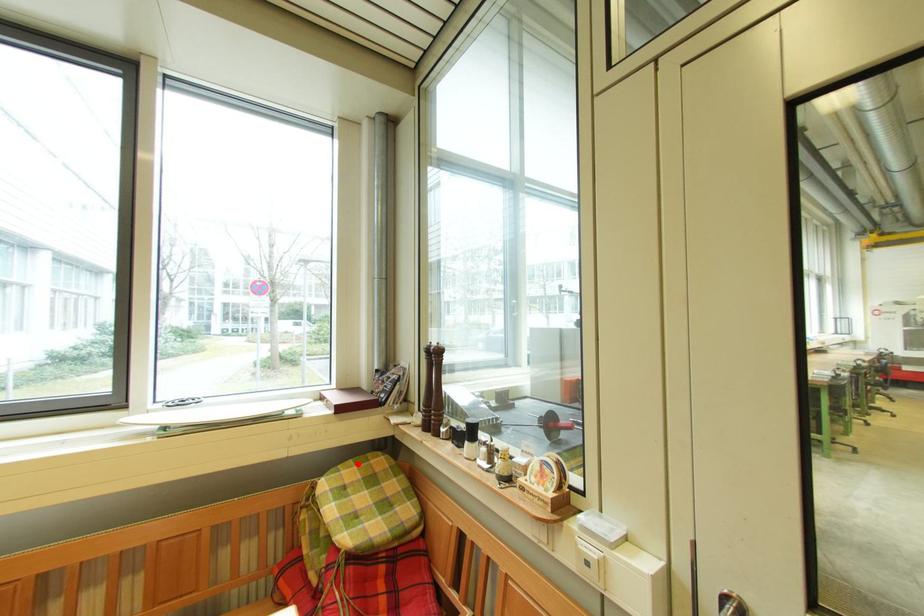
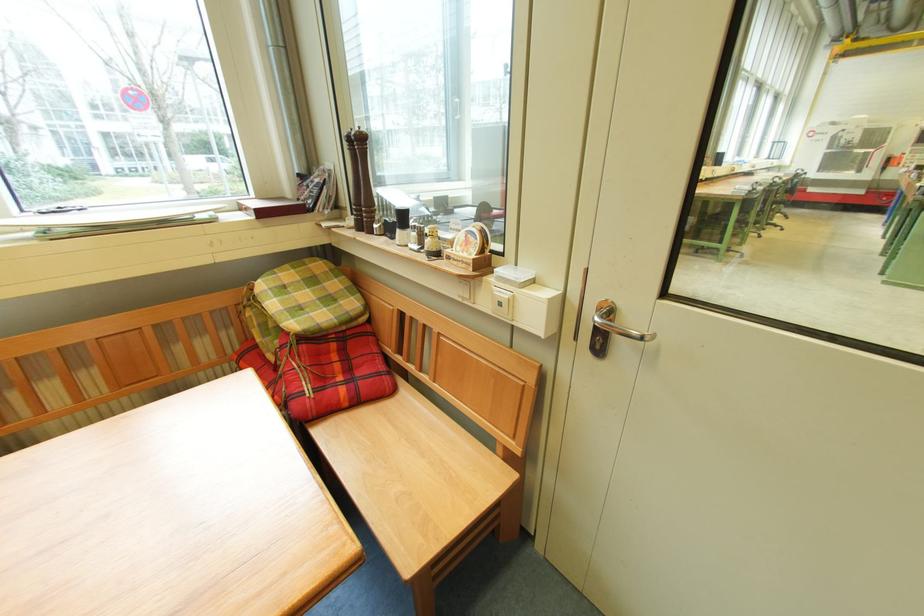
Where in the second image is the point corresponding to the highlighted location from the first image?

(295, 268)